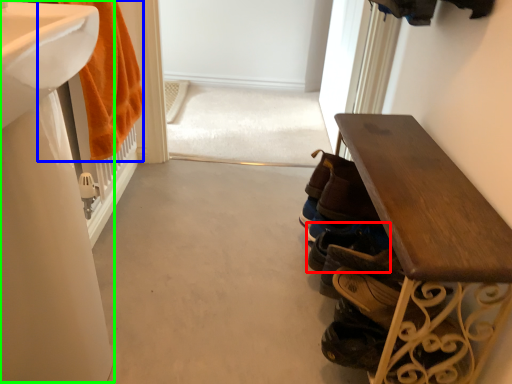
Question: Which object is the farthest from footwear (highlighted by a red box)? Choose among these: bath towel (highlighted by a blue box) or sink (highlighted by a green box).

Choices:
 (A) bath towel
 (B) sink

Answer: (A)